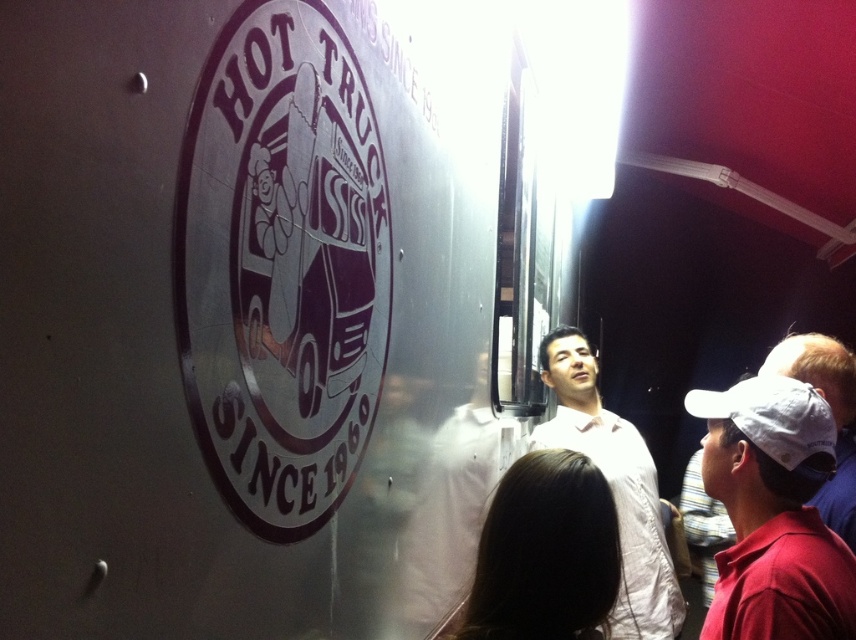
You are standing in a park and see the metallic silver food truck at center and the white fabric baseball cap at right. Which object is higher in the image?

The metallic silver food truck at center is higher than the white fabric baseball cap at right.

You are a customer waiting in line for the food truck. You notice two baseball caps nearby. The first is a white matte baseball cap at upper right, and the second is a white fabric baseball cap at right. Which one is narrower in width?

The white matte baseball cap at upper right is thinner than the white fabric baseball cap at right, so the white matte baseball cap at upper right is narrower in width.

You are standing at the origin point of the coordinate system. Where is the metallic silver food truck at center located?

The metallic silver food truck at center is located at point (263,308).